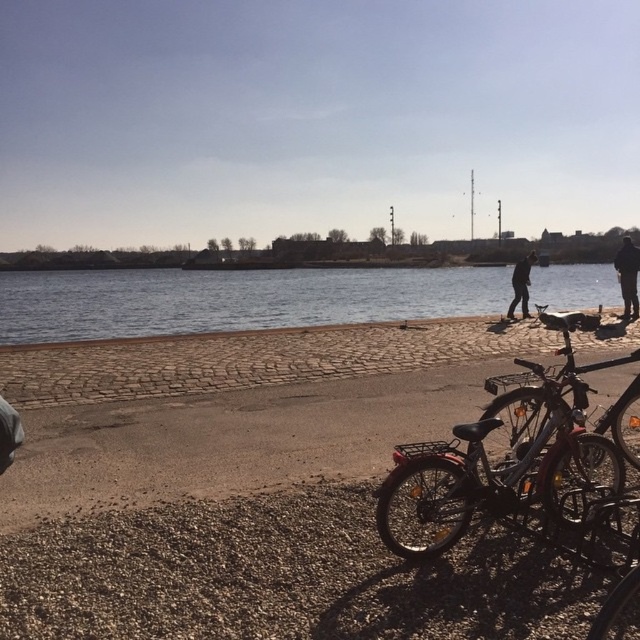
Does shiny metallic bicycle at center have a larger size compared to dark gray pants at right?

No, shiny metallic bicycle at center is not bigger than dark gray pants at right.

The height and width of the screenshot is (640, 640). Describe the element at coordinates (524, 464) in the screenshot. I see `shiny metallic bicycle at center` at that location.

Describe the element at coordinates (524, 464) in the screenshot. The image size is (640, 640). I see `shiny metallic bicycle at center` at that location.

Identify the location of shiny metallic bicycle at center. The height and width of the screenshot is (640, 640). (524, 464).

Is dark gray pants at right smaller than black fabric jacket at center?

No, dark gray pants at right is not smaller than black fabric jacket at center.

The image size is (640, 640). What do you see at coordinates (627, 276) in the screenshot?
I see `dark gray pants at right` at bounding box center [627, 276].

Where is `dark gray pants at right`? This screenshot has height=640, width=640. dark gray pants at right is located at coordinates (627, 276).

I want to click on dark gray pants at right, so click(x=627, y=276).

Can you confirm if blue water at center is bigger than shiny metallic bicycle at center?

Correct, blue water at center is larger in size than shiny metallic bicycle at center.

Is the position of blue water at center more distant than that of shiny metallic bicycle at center?

Yes.

Image resolution: width=640 pixels, height=640 pixels. I want to click on blue water at center, so click(234, 300).